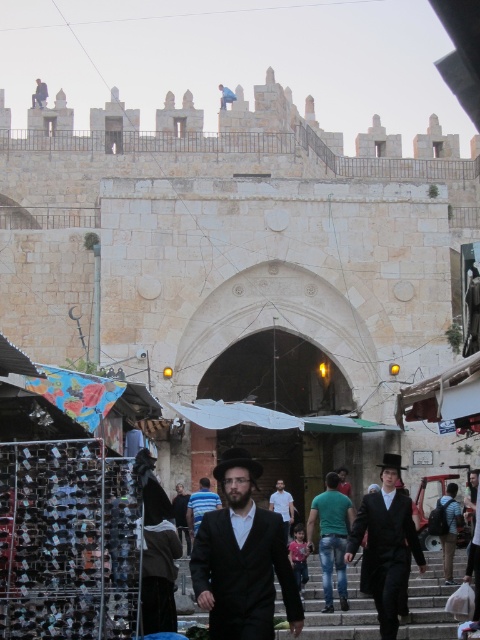
Question: Is gray stone stairs at center to the left of dark blue suit at center from the viewer's perspective?

Choices:
 (A) yes
 (B) no

Answer: (B)

Question: Is gray stone stairs at center in front of green cotton shirt at center?

Choices:
 (A) no
 (B) yes

Answer: (B)

Question: Which point is farther from the camera taking this photo?

Choices:
 (A) (391, 582)
 (B) (196, 496)

Answer: (B)

Question: Is gray stone stairs at center below black matte suit at center?

Choices:
 (A) yes
 (B) no

Answer: (A)

Question: Which point is closer to the camera taking this photo?

Choices:
 (A) (380, 628)
 (B) (220, 502)
 (C) (362, 630)
 (D) (207, 570)

Answer: (D)

Question: Which point is farther from the camera taking this photo?

Choices:
 (A) (x=194, y=493)
 (B) (x=417, y=561)
 (C) (x=330, y=611)
 (D) (x=194, y=561)

Answer: (A)